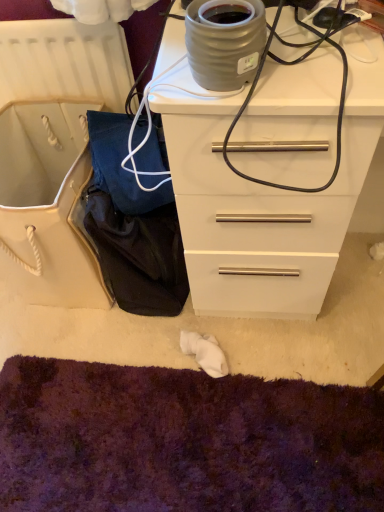
Question: Is white glossy chest of drawers at upper right bigger or smaller than purple shaggy carpet at lower center?

Choices:
 (A) small
 (B) big

Answer: (B)

Question: Is white glossy chest of drawers at upper right inside or outside of purple shaggy carpet at lower center?

Choices:
 (A) inside
 (B) outside

Answer: (B)

Question: Estimate the real-world distances between objects in this image. Which object is farther from the purple shaggy carpet at lower center?

Choices:
 (A) matte gray ceramic pot at upper center
 (B) white glossy chest of drawers at upper right

Answer: (A)

Question: Based on their relative distances, which object is farther from the purple shaggy carpet at lower center?

Choices:
 (A) matte gray ceramic pot at upper center
 (B) white glossy chest of drawers at upper right

Answer: (A)